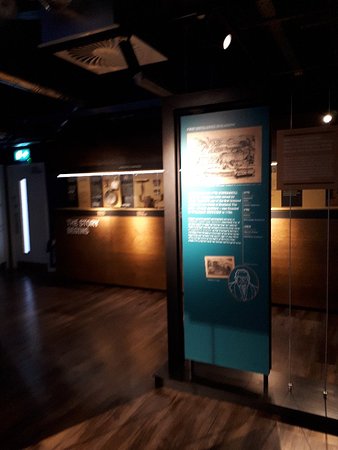
Image resolution: width=338 pixels, height=450 pixels. I want to click on exhibit sign, so click(220, 210).